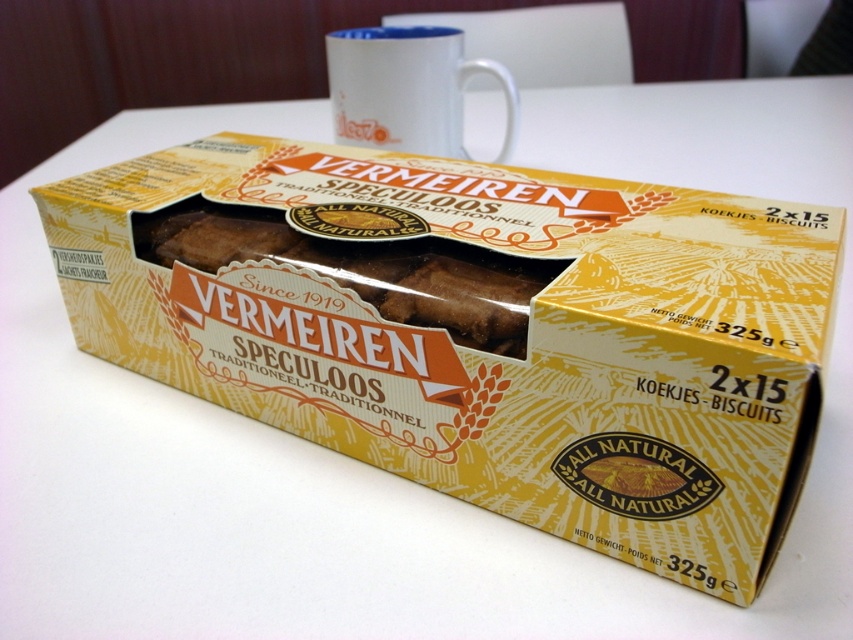
From the picture: Is brown matte speculoos box at center in front of white ceramic mug at upper center?

That is True.

Find the location of a particular element. The height and width of the screenshot is (640, 853). brown matte speculoos box at center is located at coordinates (486, 332).

Between brown crumbly biscuit at center and white ceramic mug at upper center, which one has more height?

white ceramic mug at upper center

You are a GUI agent. You are given a task and a screenshot of the screen. Output one action in this format:
    pyautogui.click(x=<x>, y=<y>)
    Task: Click on the brown crumbly biscuit at center
    This screenshot has height=640, width=853.
    Given the screenshot: What is the action you would take?
    (x=363, y=268)

Is brown matte speculoos box at center thinner than brown crumbly biscuit at center?

In fact, brown matte speculoos box at center might be wider than brown crumbly biscuit at center.

Locate an element on the screen. The image size is (853, 640). brown matte speculoos box at center is located at coordinates (486, 332).